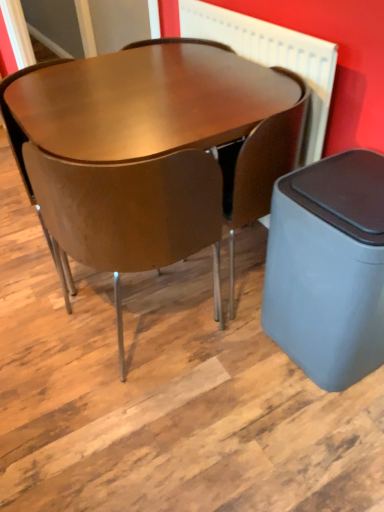
Where is `empty space that is ontop of glossy wood table at center (from a real-world perspective)`? This screenshot has height=512, width=384. empty space that is ontop of glossy wood table at center (from a real-world perspective) is located at coordinates (150, 89).